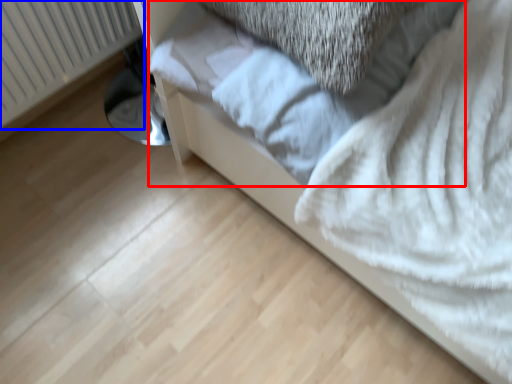
Question: Which of the following is the farthest to the observer, sheet (highlighted by a red box) or radiator (highlighted by a blue box)?

Choices:
 (A) sheet
 (B) radiator

Answer: (B)